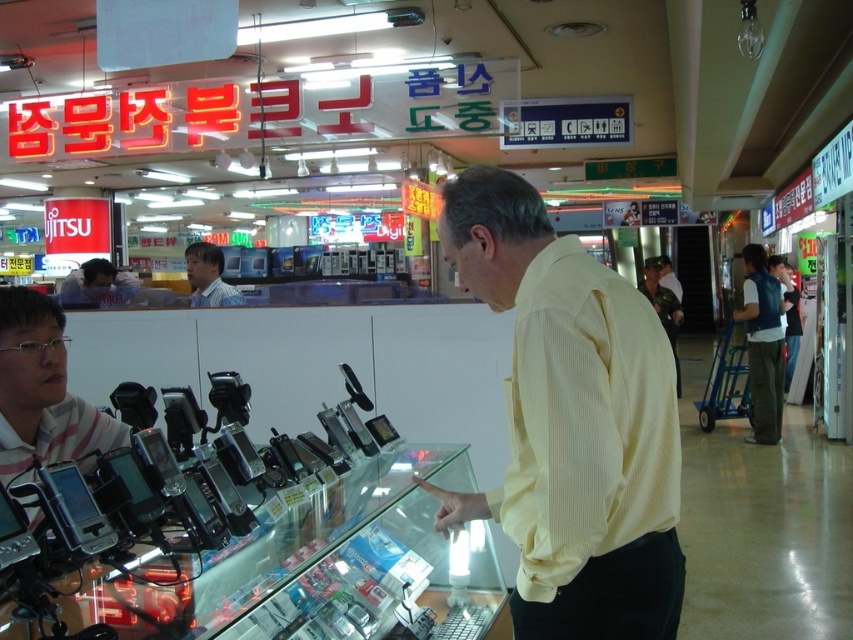
You are a customer in the electronics store and you see two shirts displayed on mannequins at the center of the store. The shirts are labeled as the yellow striped shirt at center and the camouflage fabric shirt at center. Which shirt takes up less space in the display?

The yellow striped shirt at center has a smaller size compared to the camouflage fabric shirt at center, so it takes up less space in the display.

You are standing in the electronics store and want to know which of the two points, point (579, 477) or point (665, 321), is closer to the glass display counter. Can you determine this based on their positions?

Point (579, 477) is in front of point (665, 321), so it is closer to the glass display counter.